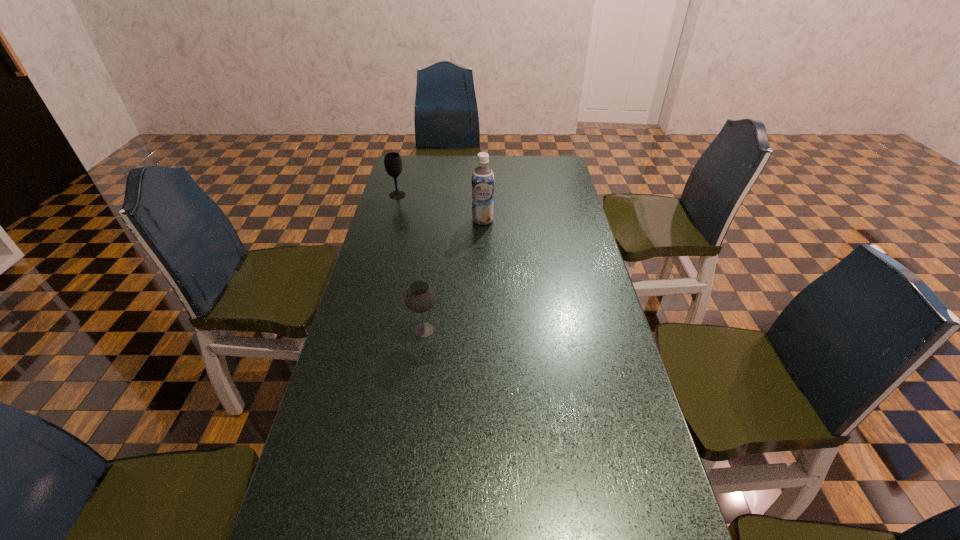
This screenshot has width=960, height=540. I want to click on the tallest object, so click(482, 177).

Locate an element on the screen. The height and width of the screenshot is (540, 960). the rightmost object is located at coordinates (482, 177).

Locate an element on the screen. Image resolution: width=960 pixels, height=540 pixels. the farther wineglass is located at coordinates (392, 161).

Where is `the leftmost object`? This screenshot has height=540, width=960. the leftmost object is located at coordinates (392, 161).

Where is `the nearer wineglass`? The width and height of the screenshot is (960, 540). the nearer wineglass is located at coordinates 419,298.

Find the location of a particular element. the right wineglass is located at coordinates (419, 298).

This screenshot has width=960, height=540. I want to click on free location located on the label of the second nearest object, so click(x=483, y=266).

Identify the location of vacant space located on the right of the farthest object. (471, 195).

The image size is (960, 540). Find the location of `blank space located 0.220m on the back of the nearest object`. blank space located 0.220m on the back of the nearest object is located at coordinates (431, 270).

At what (x,y) coordinates should I click in order to perform the action: click on object positioned at the left edge. Please return your answer as a coordinate pair (x, y). Looking at the image, I should click on (392, 161).